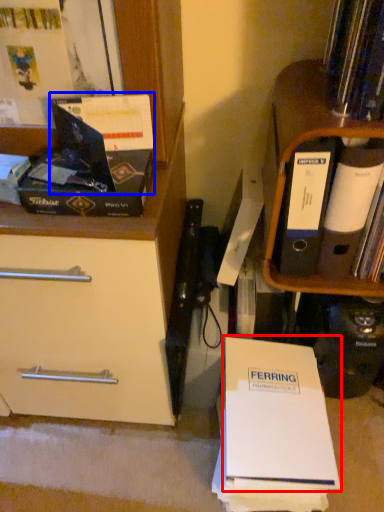
Question: Among these objects, which one is farthest to the camera, paperback book (highlighted by a red box) or paperback book (highlighted by a blue box)?

Choices:
 (A) paperback book
 (B) paperback book

Answer: (A)